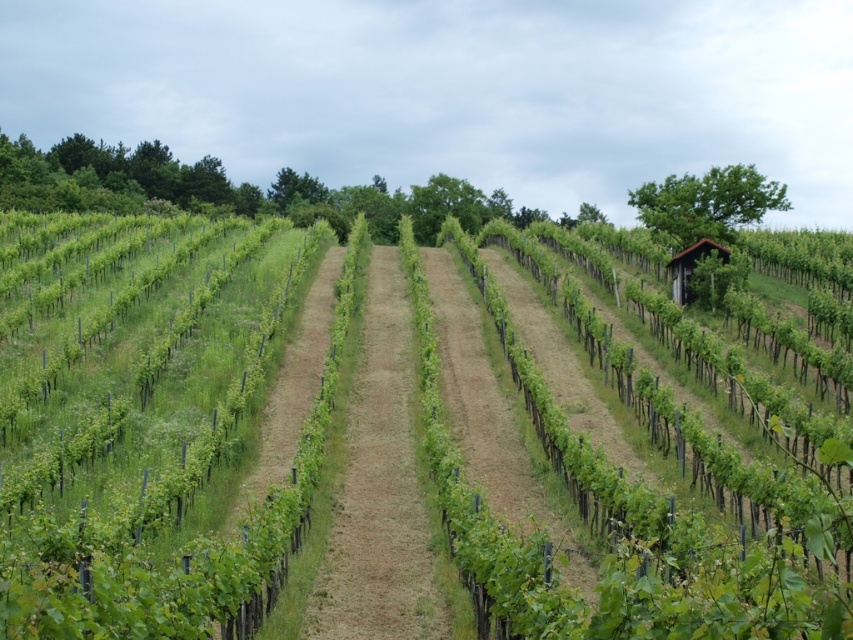
Question: Observing the image, what is the correct spatial positioning of green leafy vines at center in reference to green grass at center?

Choices:
 (A) left
 (B) right

Answer: (A)

Question: Which point is closer to the camera?

Choices:
 (A) green leafy vines at center
 (B) green grass at center

Answer: (A)

Question: Considering the relative positions of green leafy vines at center and green grass at center in the image provided, where is green leafy vines at center located with respect to green grass at center?

Choices:
 (A) above
 (B) below

Answer: (A)

Question: Which point appears closest to the camera in this image?

Choices:
 (A) (364, 483)
 (B) (589, 614)

Answer: (B)

Question: Observing the image, what is the correct spatial positioning of green leafy vines at center in reference to green grass at center?

Choices:
 (A) left
 (B) right

Answer: (A)